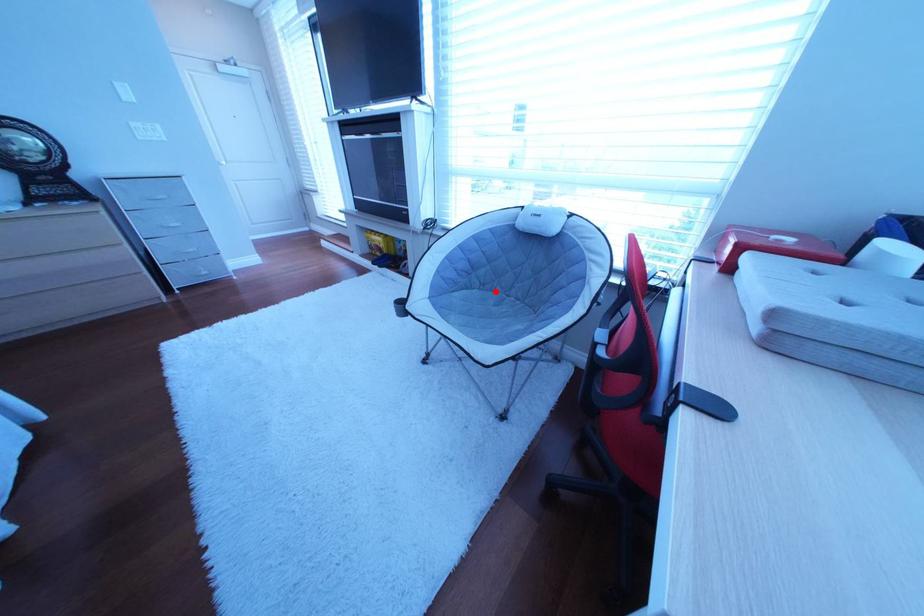
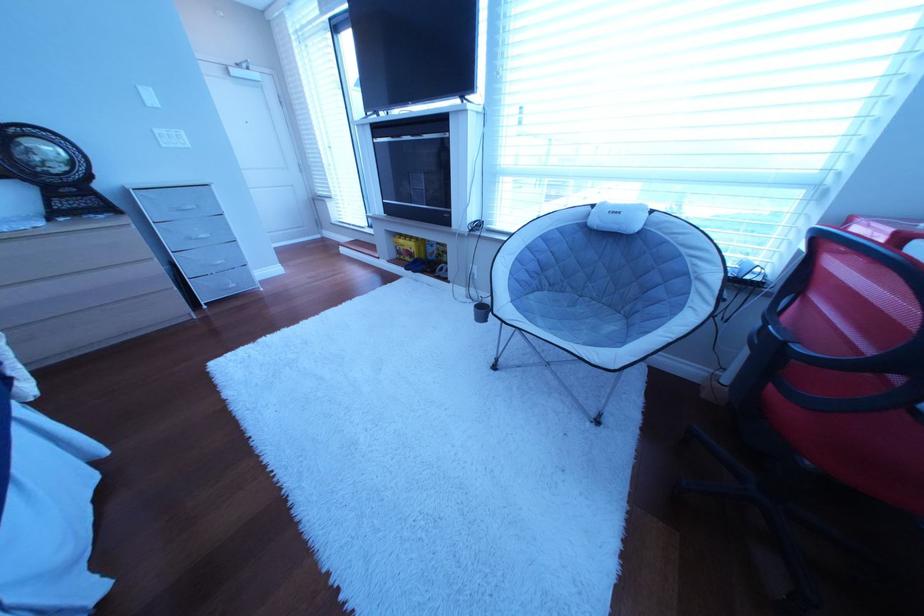
Question: I am providing you with two images of the same scene from different viewpoints. A red point is marked on the first image. Is the red point's position out of view in image 2?

Choices:
 (A) Yes
 (B) No

Answer: (B)